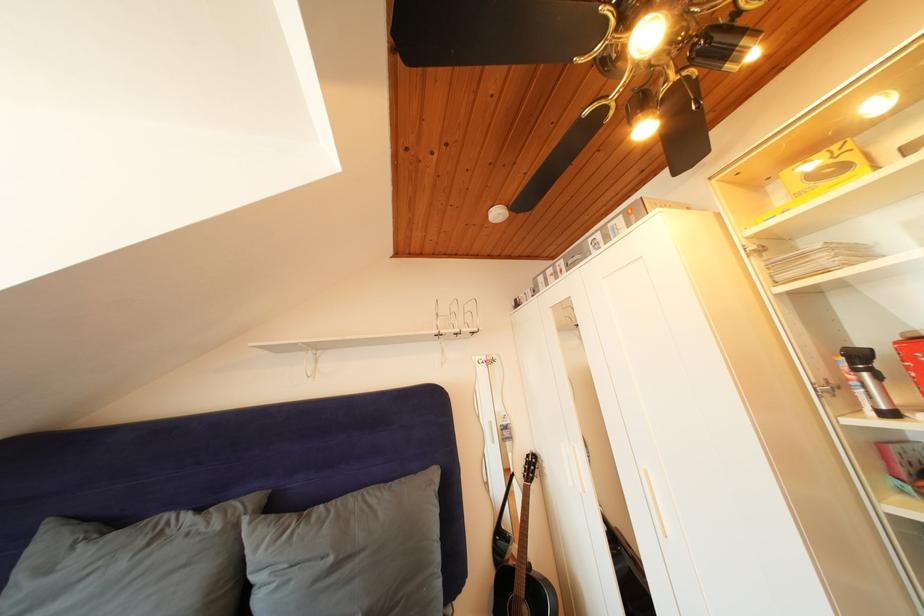
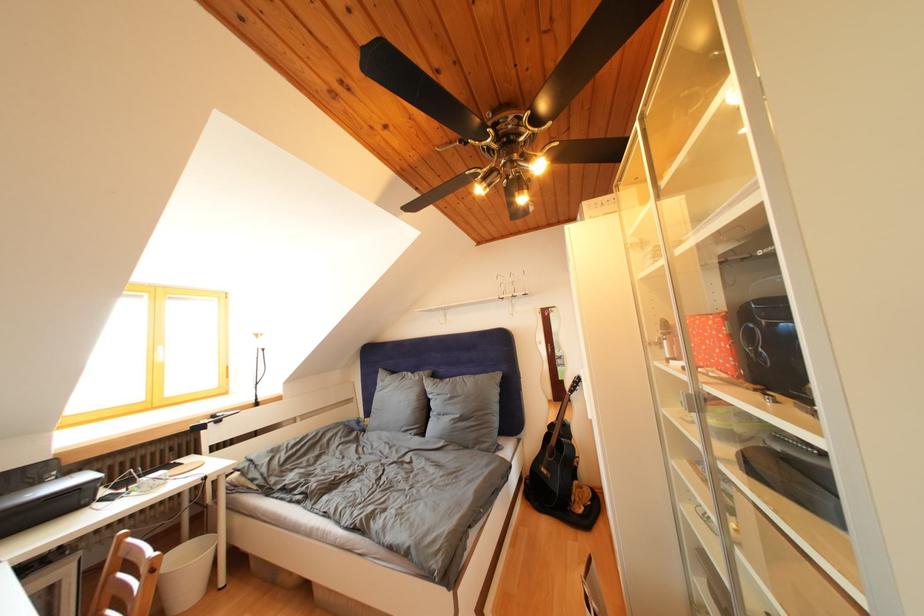
Find the pixel in the second image that matches the point at 225,531 in the first image.

(426, 383)